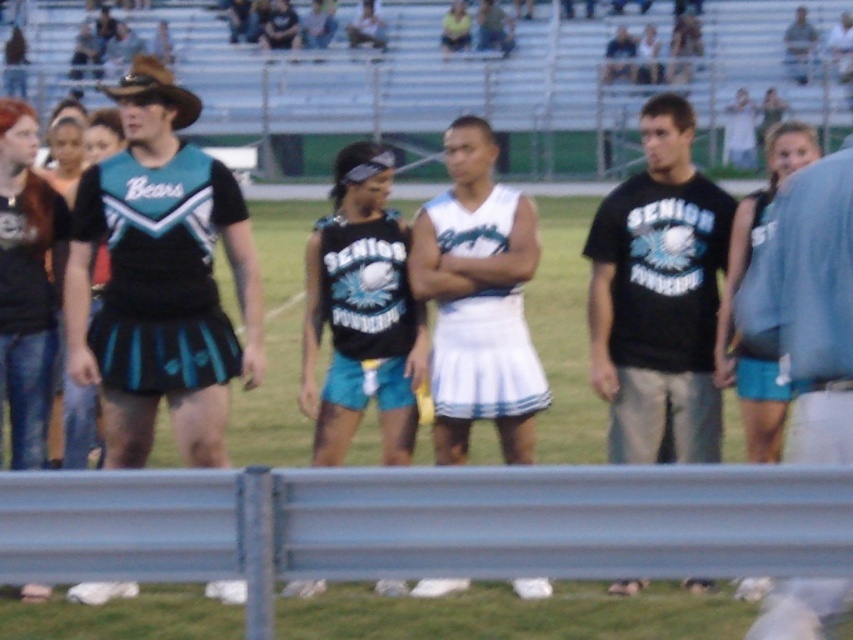
Question: Does metallic gray rail at lower center have a greater width compared to matte black uniform at left?

Choices:
 (A) no
 (B) yes

Answer: (B)

Question: Can you confirm if black jersey at center is positioned above matte black tank top at center?

Choices:
 (A) yes
 (B) no

Answer: (B)

Question: Which of these objects is positioned farthest from the brown leather cowboy hat at upper left?

Choices:
 (A) black cotton t-shirt at center
 (B) black jersey at center

Answer: (A)

Question: Can you confirm if black cotton t-shirt at center is positioned below black jersey at center?

Choices:
 (A) yes
 (B) no

Answer: (B)

Question: Among these objects, which one is nearest to the camera?

Choices:
 (A) metallic gray rail at lower center
 (B) black jersey at center

Answer: (A)

Question: Which point is closer to the camera?

Choices:
 (A) matte black uniform at left
 (B) matte black cheerleading outfit at left
 (C) blue denim shorts at right

Answer: (C)